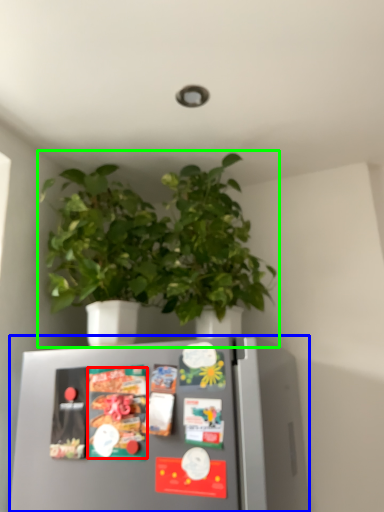
Question: Estimate the real-world distances between objects in this image. Which object is farther from food (highlighted by a red box), refrigerator (highlighted by a blue box) or houseplant (highlighted by a green box)?

Choices:
 (A) refrigerator
 (B) houseplant

Answer: (B)